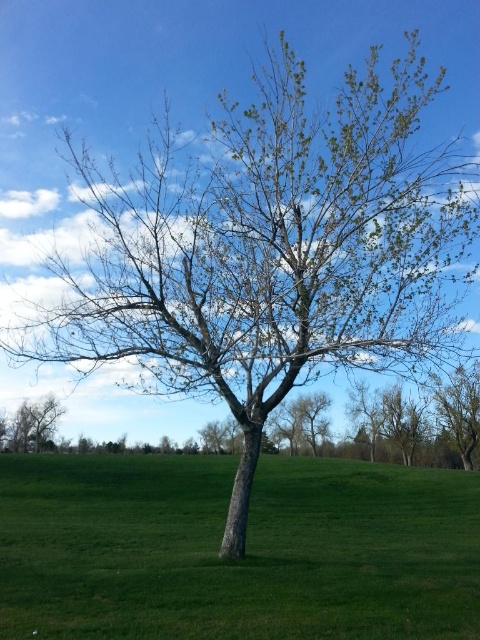
Does green grass at center have a lesser height compared to green matte tree at lower left?

No.

Is green grass at center thinner than green matte tree at lower left?

Incorrect, green grass at center's width is not less than green matte tree at lower left's.

Is point (379, 470) less distant than point (32, 420)?

That is True.

You are a GUI agent. You are given a task and a screenshot of the screen. Output one action in this format:
    pyautogui.click(x=<x>, y=<y>)
    Task: Click on the green grass at center
    The width and height of the screenshot is (480, 640).
    Given the screenshot: What is the action you would take?
    pyautogui.click(x=244, y=556)